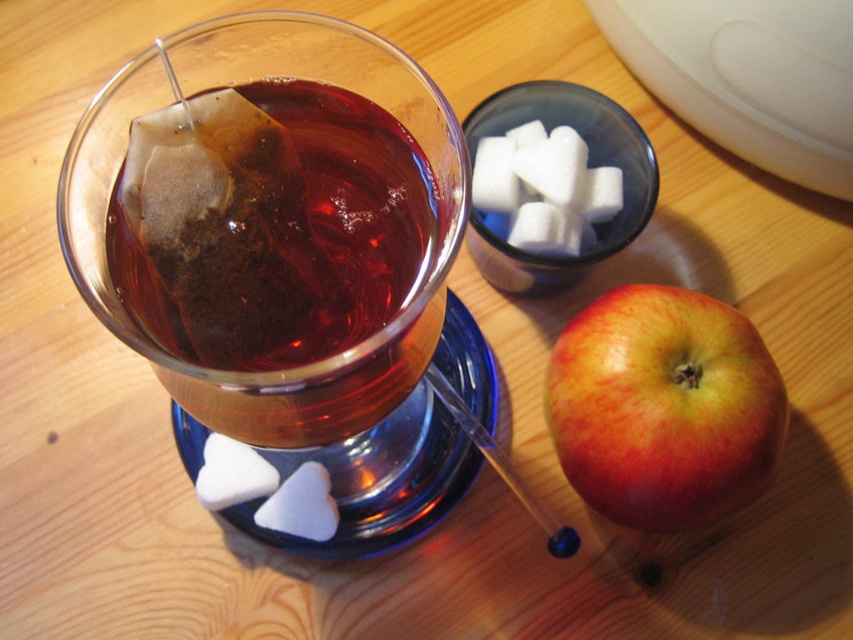
Question: Considering the relative positions of translucent paper tea bag at upper left and red matte apple at lower right in the image provided, where is translucent paper tea bag at upper left located with respect to red matte apple at lower right?

Choices:
 (A) above
 (B) below

Answer: (A)

Question: Where is translucent paper tea bag at upper left located in relation to red matte apple at lower right in the image?

Choices:
 (A) right
 (B) left

Answer: (B)

Question: Which point is closer to the camera taking this photo?

Choices:
 (A) (370, 209)
 (B) (682, 353)

Answer: (A)

Question: Which point appears closest to the camera in this image?

Choices:
 (A) (300, 321)
 (B) (697, 356)

Answer: (A)

Question: Can you confirm if translucent paper tea bag at upper left is wider than red matte apple at lower right?

Choices:
 (A) no
 (B) yes

Answer: (B)